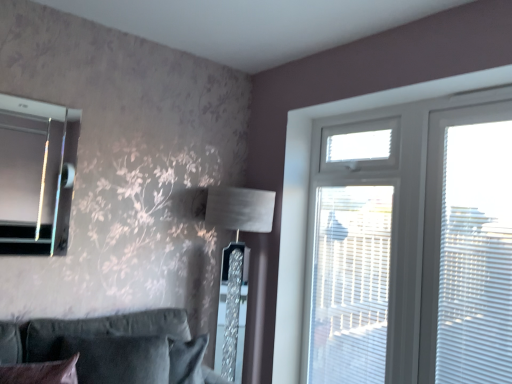
Question: Is white plastic window at upper right placed right next to white plastic screen door at upper right?

Choices:
 (A) yes
 (B) no

Answer: (B)

Question: Does white plastic window at upper right lie behind white plastic screen door at upper right?

Choices:
 (A) no
 (B) yes

Answer: (A)

Question: Can you confirm if white plastic window at upper right is wider than white plastic screen door at upper right?

Choices:
 (A) yes
 (B) no

Answer: (A)

Question: Does white plastic window at upper right have a smaller size compared to white plastic screen door at upper right?

Choices:
 (A) yes
 (B) no

Answer: (B)

Question: Is white plastic window at upper right closer to the viewer compared to white plastic screen door at upper right?

Choices:
 (A) yes
 (B) no

Answer: (A)

Question: From a real-world perspective, is satin silver lampshade at center positioned above or below white plastic window at upper right?

Choices:
 (A) below
 (B) above

Answer: (A)

Question: Is satin silver lampshade at center inside or outside of white plastic window at upper right?

Choices:
 (A) inside
 (B) outside

Answer: (B)

Question: From the image's perspective, is satin silver lampshade at center positioned above or below white plastic window at upper right?

Choices:
 (A) below
 (B) above

Answer: (A)

Question: In terms of width, does satin silver lampshade at center look wider or thinner when compared to white plastic window at upper right?

Choices:
 (A) wide
 (B) thin

Answer: (A)

Question: In the image, is velvet dark brown pillow at lower left positioned in front of or behind satin silver lampshade at center?

Choices:
 (A) behind
 (B) front

Answer: (B)

Question: Would you say velvet dark brown pillow at lower left is to the left or to the right of satin silver lampshade at center in the picture?

Choices:
 (A) right
 (B) left

Answer: (B)

Question: Considering the positions of point (35, 370) and point (215, 210), is point (35, 370) closer or farther from the camera than point (215, 210)?

Choices:
 (A) farther
 (B) closer

Answer: (B)

Question: Looking at the image, does velvet dark brown pillow at lower left seem bigger or smaller compared to satin silver lampshade at center?

Choices:
 (A) small
 (B) big

Answer: (A)

Question: Visually, is white plastic blinds at right positioned to the left or to the right of matte glass bay window at upper left?

Choices:
 (A) right
 (B) left

Answer: (A)

Question: From the image's perspective, is white plastic blinds at right positioned above or below matte glass bay window at upper left?

Choices:
 (A) below
 (B) above

Answer: (A)